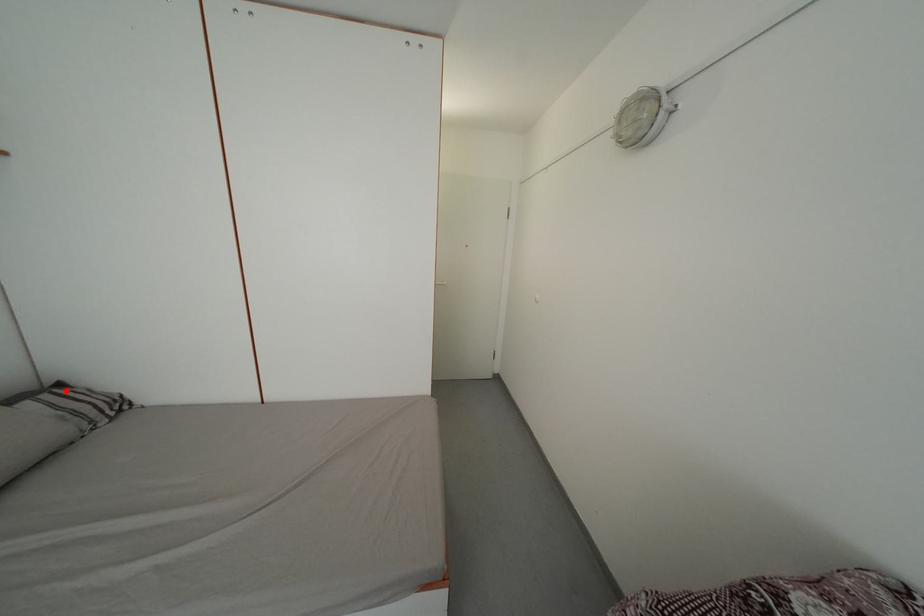
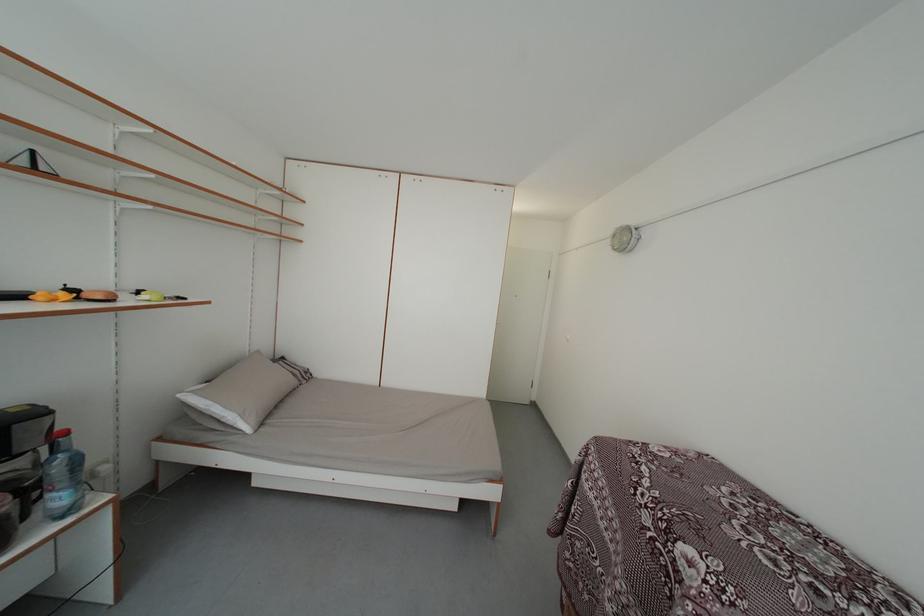
Question: I am providing you with two images of the same scene from different viewpoints. In image1, a red point is highlighted. Considering the same 3D point in image2, which of the following is correct?

Choices:
 (A) It is closer
 (B) It is farther

Answer: (A)